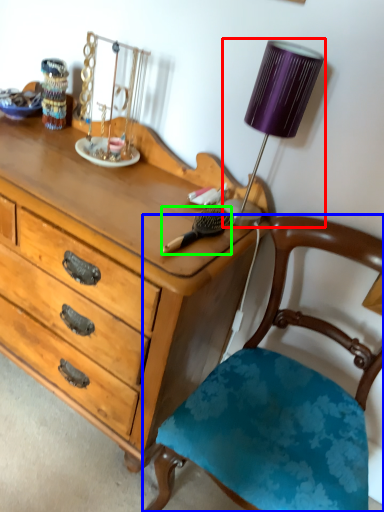
Question: Which object is the closest to the lamp (highlighted by a red box)? Choose among these: chair (highlighted by a blue box) or brush (highlighted by a green box).

Choices:
 (A) chair
 (B) brush

Answer: (B)